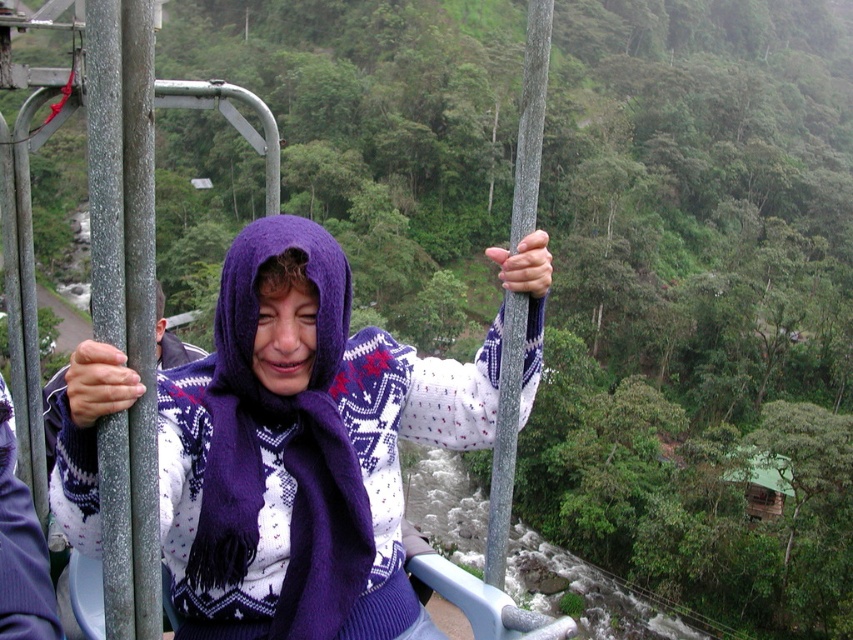
You are a maintenance worker needing to inspect two poles in a cable car. The smooth gray pole at left and the smooth metal pole at center are both in need of inspection. If your inspection tool has a 4 meter long reach, can you check both poles without moving your position?

The distance between the smooth gray pole at left and the smooth metal pole at center is 3.92 meters, so yes, the inspection tool can reach both poles without moving since the distance is within the 4 meter limit.

You are standing near the cable car and want to hand a small gift to the person wearing the purple knitted sweater at center. Considering the distance between you and the sweater, can you safely throw the gift without needing to move closer?

The distance between the purple knitted sweater at center and the viewer is 10.10 feet. Since 10.10 feet is a considerable distance, it might be challenging to accurately throw the gift that far. It is advisable to move closer for a safer and more precise delivery.

You are a passenger in the cable car and want to place a small backpack on the seat next to you. The seat is located at point (299, 444). Is there enough space between the purple knitted sweater at center and the edge of the seat to place the backpack?

The purple knitted sweater at center is located at point (299, 444). Since the sweater is exactly at that point, placing the backpack there might not leave enough space. Check the area around the point for more space.